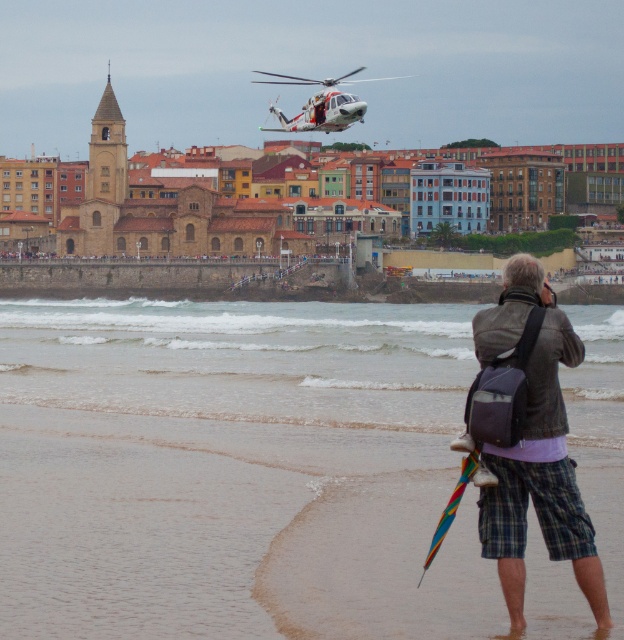
You are a photographer trying to capture the entire scene in one shot. You notice the sandy beach at lower left and the white matte helicopter at upper center. Which object is wider in the image?

The sandy beach at lower left is wider than the white matte helicopter at upper center according to the description.

You are a photographer standing on the beach and want to take a photo of the white matte helicopter at upper center without the leather jacket at lower right blocking the view. Is this possible?

The leather jacket at lower right is positioned under the white matte helicopter at upper center, so the helicopter is above the jacket. Therefore, you can take the photo without the jacket blocking the view.

You are a drone operator who needs to fly a drone from the leather jacket at lower right to the white matte helicopter at upper center. The drone has a maximum range of 150 meters. Can you safely complete the flight without exceeding the drone range?

The distance between the leather jacket at lower right and the white matte helicopter at upper center is 158.91 meters, which exceeds the drone range of 150 meters. Therefore, the flight cannot be completed safely within the drone range.